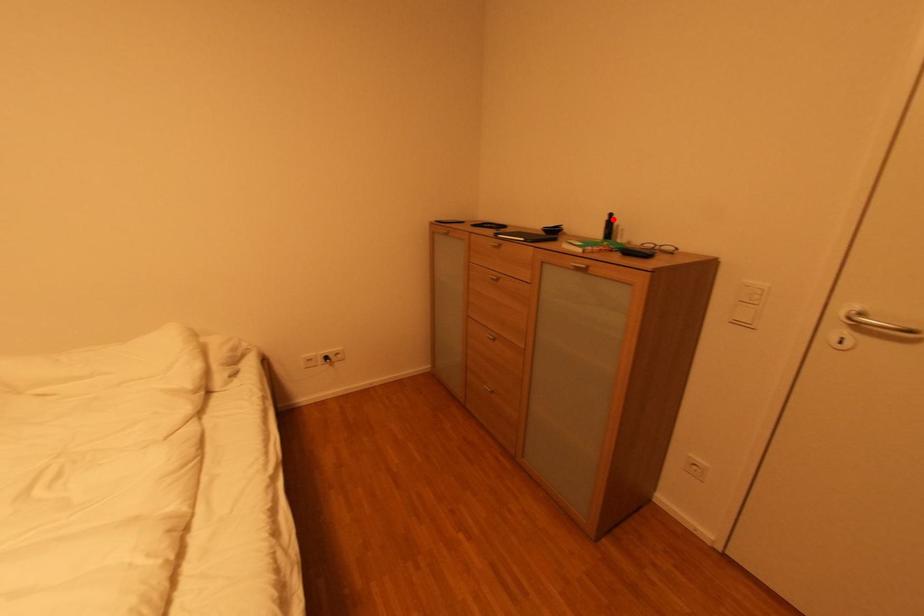
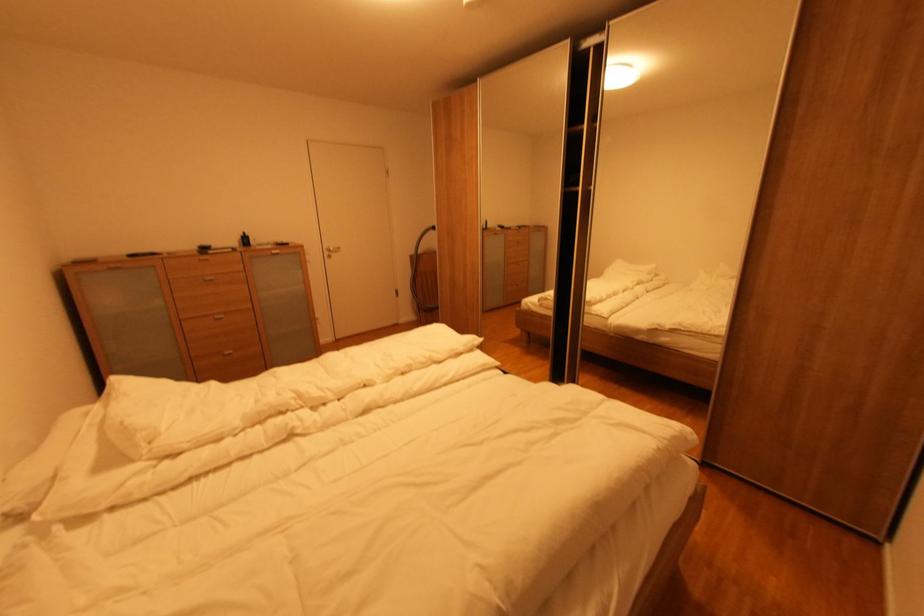
In the second image, find the point that corresponds to the highlighted location in the first image.

(248, 237)